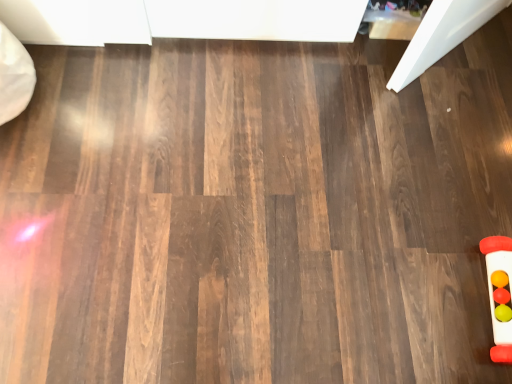
The height and width of the screenshot is (384, 512). What are the coordinates of `white glossy door at upper right` in the screenshot? It's located at (442, 35).

Measure the distance between point (462, 3) and camera.

A distance of 4.46 feet exists between point (462, 3) and camera.

What do you see at coordinates (442, 35) in the screenshot? This screenshot has width=512, height=384. I see `white glossy door at upper right` at bounding box center [442, 35].

This screenshot has height=384, width=512. Find the location of `white glossy door at upper right`. white glossy door at upper right is located at coordinates [442, 35].